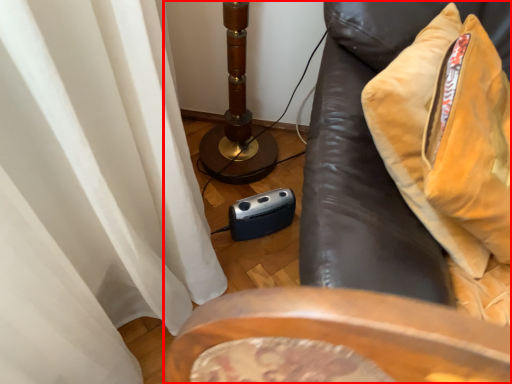
Question: Observing the image, what is the correct spatial positioning of furniture (annotated by the red box) in reference to throw pillow?

Choices:
 (A) right
 (B) left

Answer: (A)